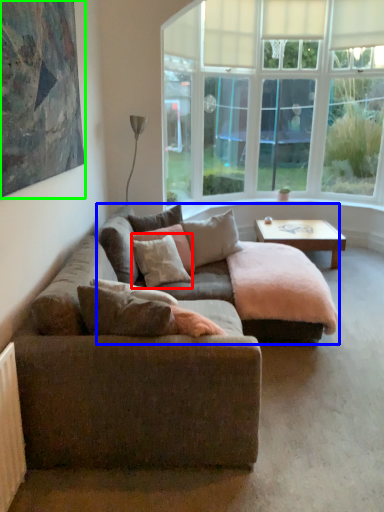
Question: Which object is the closest to the pillow (highlighted by a red box)? Choose among these: couch (highlighted by a blue box) or picture frame (highlighted by a green box).

Choices:
 (A) couch
 (B) picture frame

Answer: (A)